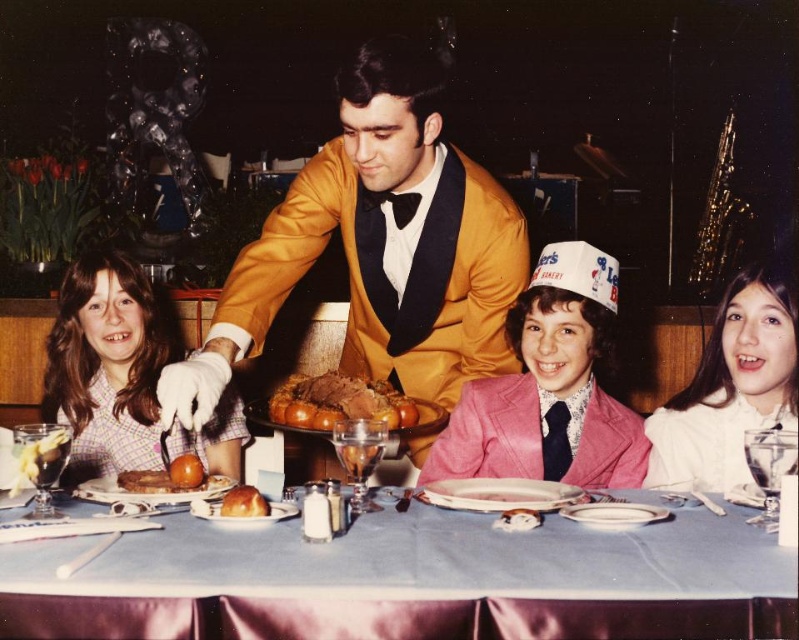
Can you confirm if gold satin tuxedo at center is positioned below white satin dress at lower right?

No.

This screenshot has height=640, width=799. Describe the element at coordinates (378, 248) in the screenshot. I see `gold satin tuxedo at center` at that location.

Where is `gold satin tuxedo at center`? This screenshot has height=640, width=799. gold satin tuxedo at center is located at coordinates (378, 248).

Does pink satin suit at center appear on the left side of golden brown roasted meat at center?

Incorrect, pink satin suit at center is not on the left side of golden brown roasted meat at center.

Does pink satin suit at center appear under golden brown roasted meat at center?

No.

Identify the location of pink satin suit at center. (549, 388).

Can you confirm if white satin dress at lower right is positioned below orange glazed donut at center?

No, white satin dress at lower right is not below orange glazed donut at center.

The height and width of the screenshot is (640, 799). Identify the location of white satin dress at lower right. tap(730, 388).

Where is `white satin dress at lower right`? This screenshot has width=799, height=640. white satin dress at lower right is located at coordinates point(730,388).